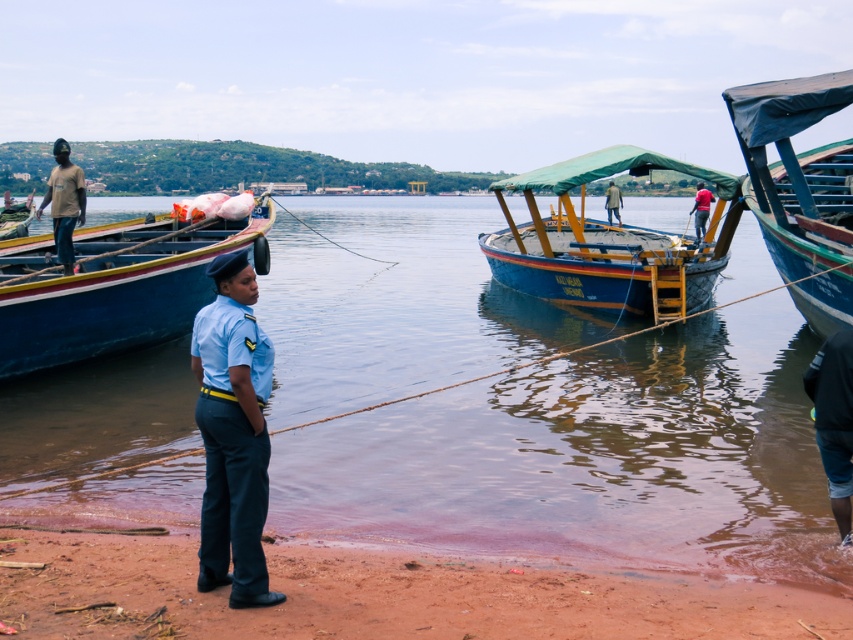
Question: Which point appears farthest from the camera in this image?

Choices:
 (A) [711, 198]
 (B) [212, 284]
 (C) [798, 221]
 (D) [608, 188]

Answer: (D)

Question: Which of the following is the farthest from the observer?

Choices:
 (A) (105, 330)
 (B) (57, 236)

Answer: (B)

Question: Which of the following is the farthest from the observer?

Choices:
 (A) (71, 177)
 (B) (650, 289)
 (C) (500, 620)

Answer: (B)

Question: Is blue painted wood boat at left smaller than red fabric shirt at center?

Choices:
 (A) yes
 (B) no

Answer: (A)

Question: Is dark blue denim shorts at lower right to the left of matte brown shirt at left from the viewer's perspective?

Choices:
 (A) yes
 (B) no

Answer: (B)

Question: From the image, what is the correct spatial relationship of clear water at center in relation to blue painted wood boat at center?

Choices:
 (A) below
 (B) above

Answer: (B)